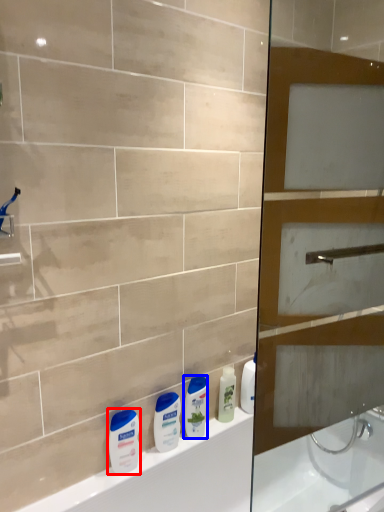
Question: Which object is closer to the camera taking this photo, toiletry (highlighted by a red box) or cleaning product (highlighted by a blue box)?

Choices:
 (A) toiletry
 (B) cleaning product

Answer: (A)